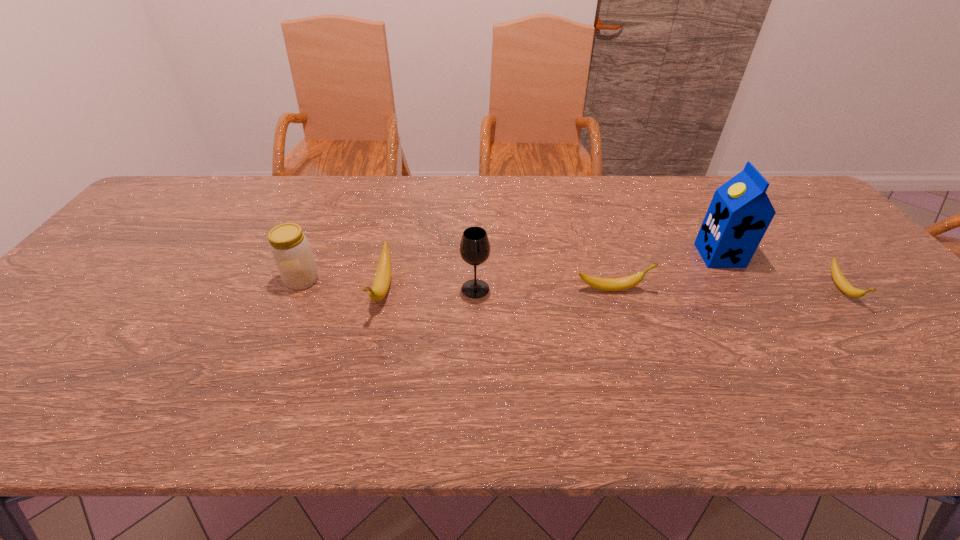
In order to click on the fourth tallest object in this screenshot , I will do `click(382, 279)`.

Identify the location of the leftmost banana. The width and height of the screenshot is (960, 540). (382, 279).

Find the location of `the fifth tallest object`. the fifth tallest object is located at coordinates (605, 284).

You are a GUI agent. You are given a task and a screenshot of the screen. Output one action in this format:
    pyautogui.click(x=<x>, y=<y>)
    Task: Click on the third object from right to left
    The image size is (960, 540).
    Given the screenshot: What is the action you would take?
    pos(605,284)

The image size is (960, 540). I want to click on the shortest banana, so click(842, 283).

Identify the location of the rightmost banana. This screenshot has width=960, height=540. (842, 283).

Find the location of a particular element. This screenshot has height=540, width=960. wineglass is located at coordinates coord(474,248).

Identify the location of jar. (291, 251).

I want to click on carton, so click(x=740, y=212).

I want to click on the tallest object, so click(x=740, y=212).